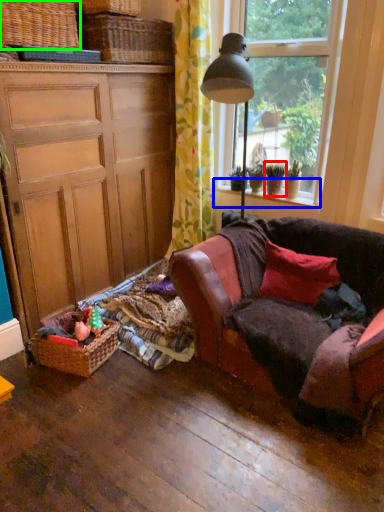
Question: Which object is the farthest from houseplant (highlighted by a red box)? Choose among these: window sill (highlighted by a blue box) or picnic basket (highlighted by a green box).

Choices:
 (A) window sill
 (B) picnic basket

Answer: (B)